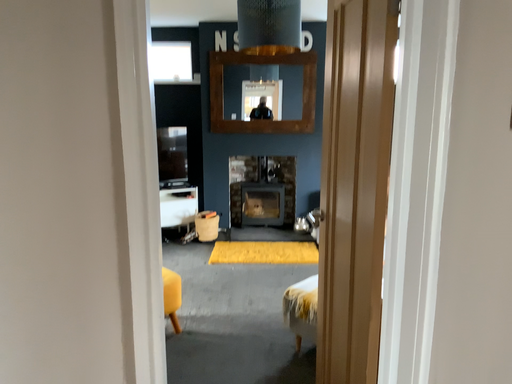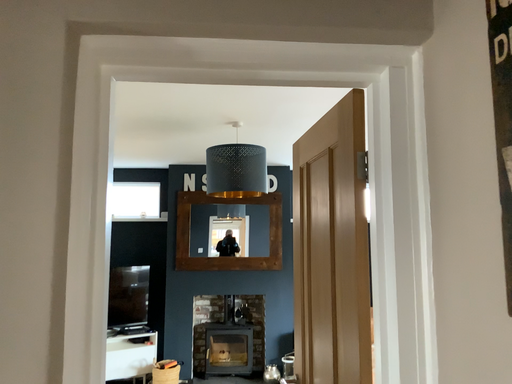
Question: How did the camera likely rotate when shooting the video?

Choices:
 (A) rotated upward
 (B) rotated downward

Answer: (A)